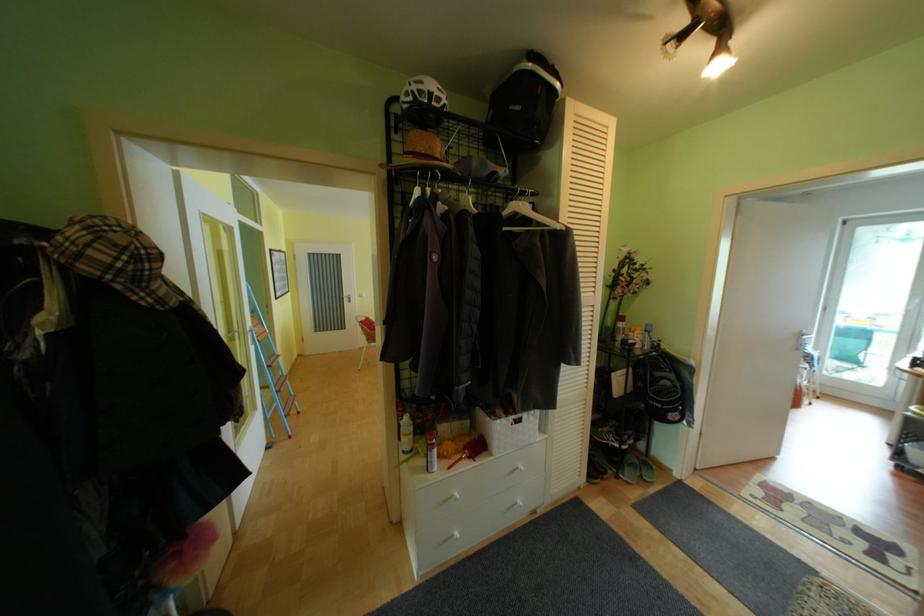
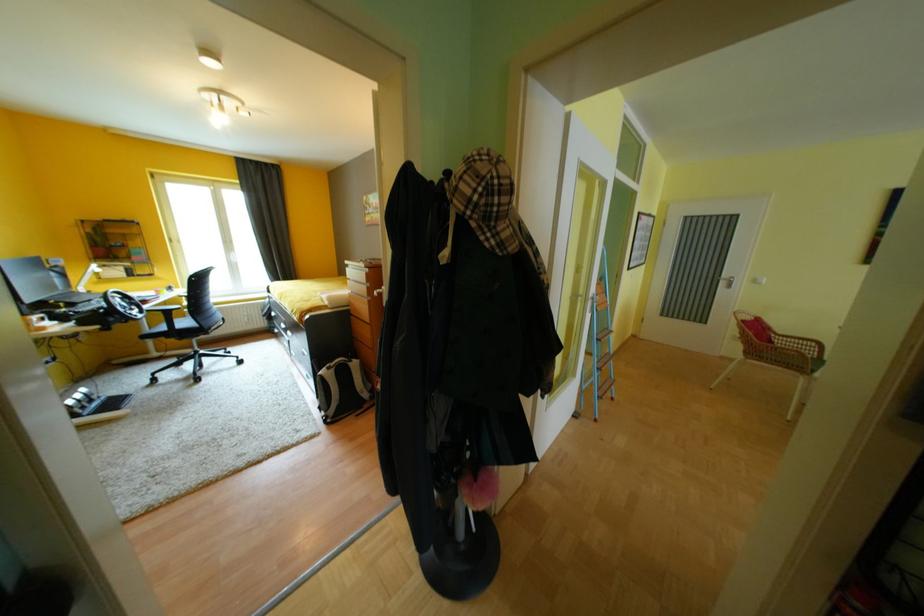
Question: The camera is either moving clockwise (left) or counter-clockwise (right) around the object. The first image is from the beginning of the video and the second image is from the end. Is the camera moving left or right when shooting the video?

Choices:
 (A) Left
 (B) Right

Answer: (B)